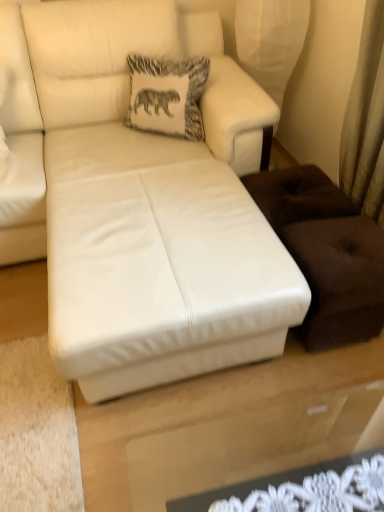
Question: Is white fabric pillow with elephant print at upper center closer to camera compared to white leather couch at center?

Choices:
 (A) no
 (B) yes

Answer: (A)

Question: From the image's perspective, is white fabric pillow with elephant print at upper center under white leather couch at center?

Choices:
 (A) yes
 (B) no

Answer: (B)

Question: Is white fabric pillow with elephant print at upper center at the right side of white leather couch at center?

Choices:
 (A) yes
 (B) no

Answer: (B)

Question: From a real-world perspective, is white fabric pillow with elephant print at upper center located higher than white leather couch at center?

Choices:
 (A) no
 (B) yes

Answer: (B)

Question: Is white fabric pillow with elephant print at upper center aimed at white leather couch at center?

Choices:
 (A) yes
 (B) no

Answer: (A)

Question: Considering the relative positions of white fabric pillow with elephant print at upper center and white leather couch at center in the image provided, is white fabric pillow with elephant print at upper center behind white leather couch at center?

Choices:
 (A) no
 (B) yes

Answer: (B)

Question: Does white leather couch at center come behind white fabric pillow with elephant print at upper center?

Choices:
 (A) yes
 (B) no

Answer: (B)

Question: Is white leather couch at center positioned before white fabric pillow with elephant print at upper center?

Choices:
 (A) no
 (B) yes

Answer: (B)

Question: From the image's perspective, does white leather couch at center appear lower than white fabric pillow with elephant print at upper center?

Choices:
 (A) yes
 (B) no

Answer: (A)

Question: Is white leather couch at center located outside white fabric pillow with elephant print at upper center?

Choices:
 (A) yes
 (B) no

Answer: (A)

Question: Is white leather couch at center bigger than white fabric pillow with elephant print at upper center?

Choices:
 (A) no
 (B) yes

Answer: (B)

Question: From the image's perspective, is white leather couch at center above white fabric pillow with elephant print at upper center?

Choices:
 (A) no
 (B) yes

Answer: (A)

Question: From a real-world perspective, is white leather couch at center positioned above or below white fabric pillow with elephant print at upper center?

Choices:
 (A) above
 (B) below

Answer: (B)